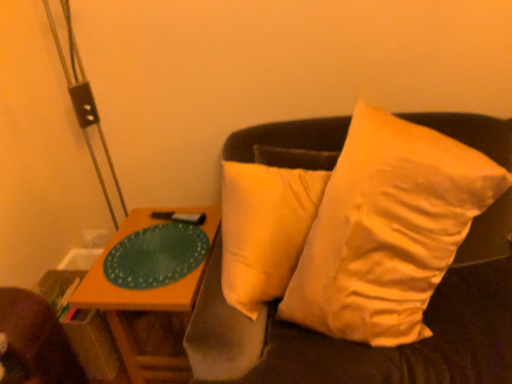
Locate an element on the screen. Image resolution: width=512 pixels, height=384 pixels. wooden table at left is located at coordinates (148, 283).

What do you see at coordinates (388, 230) in the screenshot? The height and width of the screenshot is (384, 512). I see `white soft pillow at upper right` at bounding box center [388, 230].

At what (x,y) coordinates should I click in order to perform the action: click on green matte glass plate at left. Please return your answer as a coordinate pair (x, y). Looking at the image, I should click on (156, 256).

Where is `glass plate that appears below the white soft pillow at upper right (from the image's perspective)`? The width and height of the screenshot is (512, 384). glass plate that appears below the white soft pillow at upper right (from the image's perspective) is located at coordinates (156, 256).

Considering the sizes of white soft pillow at upper right and green matte glass plate at left in the image, is white soft pillow at upper right taller or shorter than green matte glass plate at left?

In the image, white soft pillow at upper right appears to be taller than green matte glass plate at left.

Is white soft pillow at upper right to the left of green matte glass plate at left from the viewer's perspective?

Incorrect, white soft pillow at upper right is not on the left side of green matte glass plate at left.

Considering the points (362, 120) and (157, 285), which point is in front, point (362, 120) or point (157, 285)?

The point (362, 120) is in front.

Between green matte glass plate at left and wooden table at left, which one has larger size?

wooden table at left is bigger.

Who is taller, green matte glass plate at left or wooden table at left?

wooden table at left.

Is green matte glass plate at left further to camera compared to wooden table at left?

Yes, the depth of green matte glass plate at left is greater than that of wooden table at left.

Is green matte glass plate at left oriented away from wooden table at left?

No, green matte glass plate at left's orientation is not away from wooden table at left.

In terms of width, does green matte glass plate at left look wider or thinner when compared to white soft pillow at upper right?

green matte glass plate at left is thinner than white soft pillow at upper right.

From a real-world perspective, is green matte glass plate at left under white soft pillow at upper right?

Yes.

Is green matte glass plate at left to the left of white soft pillow at upper right from the viewer's perspective?

Correct, you'll find green matte glass plate at left to the left of white soft pillow at upper right.

Is green matte glass plate at left positioned before white soft pillow at upper right?

That is False.

Considering the relative sizes of wooden table at left and white soft pillow at upper right in the image provided, is wooden table at left smaller than white soft pillow at upper right?

Correct, wooden table at left occupies less space than white soft pillow at upper right.

Considering the relative sizes of wooden table at left and white soft pillow at upper right in the image provided, is wooden table at left thinner than white soft pillow at upper right?

No, wooden table at left is not thinner than white soft pillow at upper right.

From a real-world perspective, is wooden table at left on top of white soft pillow at upper right?

No, from a real-world perspective, wooden table at left is not above white soft pillow at upper right.

Who is taller, white soft pillow at upper right or wooden table at left?

Standing taller between the two is white soft pillow at upper right.

Does white soft pillow at upper right turn towards wooden table at left?

No, white soft pillow at upper right does not turn towards wooden table at left.

Can you confirm if white soft pillow at upper right is wider than wooden table at left?

No, white soft pillow at upper right is not wider than wooden table at left.

Consider the image. Can wooden table at left be found inside white soft pillow at upper right?

Actually, wooden table at left is outside white soft pillow at upper right.

Is wooden table at left positioned in front of green matte glass plate at left?

Yes, the depth of wooden table at left is less than that of green matte glass plate at left.

Could green matte glass plate at left be considered to be inside wooden table at left?

No.

Where is `glass plate on the left of white soft pillow at upper right`? The width and height of the screenshot is (512, 384). glass plate on the left of white soft pillow at upper right is located at coordinates (156, 256).

Find the location of `table that is below the green matte glass plate at left (from the image's perspective)`. table that is below the green matte glass plate at left (from the image's perspective) is located at coordinates (148, 283).

Looking at the image, which one is located closer to wooden table at left, green matte glass plate at left or white soft pillow at upper right?

green matte glass plate at left is positioned closer to the anchor wooden table at left.

Considering their positions, is wooden table at left positioned further to green matte glass plate at left than white soft pillow at upper right?

white soft pillow at upper right is further to green matte glass plate at left.

Estimate the real-world distances between objects in this image. Which object is closer to wooden table at left, white soft pillow at upper right or green matte glass plate at left?

The object closer to wooden table at left is green matte glass plate at left.

Considering their positions, is wooden table at left positioned closer to white soft pillow at upper right than green matte glass plate at left?

Based on the image, green matte glass plate at left appears to be nearer to white soft pillow at upper right.

From the image, which object appears to be nearer to white soft pillow at upper right, green matte glass plate at left or wooden table at left?

green matte glass plate at left is closer to white soft pillow at upper right.

When comparing their distances from green matte glass plate at left, does white soft pillow at upper right or wooden table at left seem closer?

wooden table at left is positioned closer to the anchor green matte glass plate at left.

What are the coordinates of `table between green matte glass plate at left and white soft pillow at upper right in the horizontal direction` in the screenshot? It's located at (148, 283).